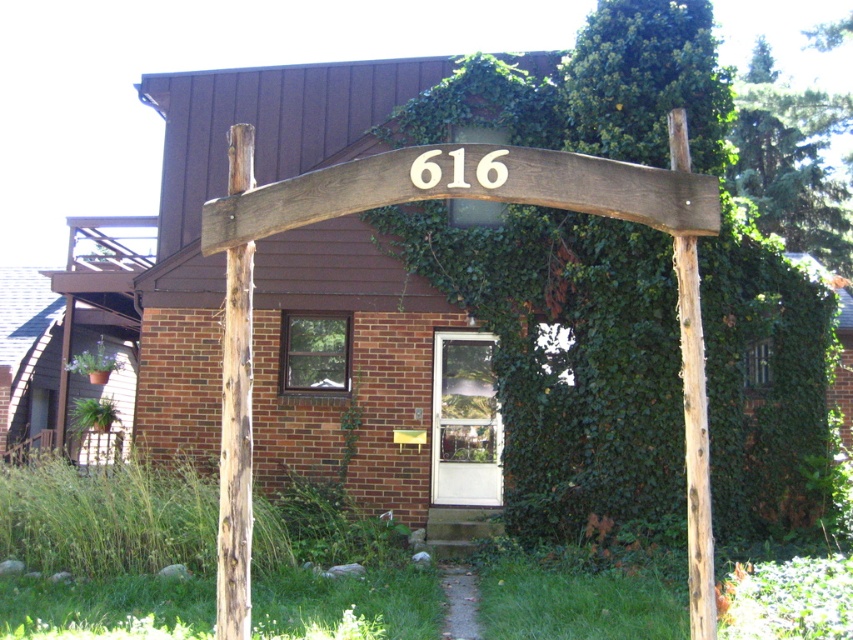
Is rough wooden post at center in front of brown rough wood post at right?

No, it is not.

This screenshot has height=640, width=853. In order to click on rough wooden post at center in this screenshot , I will do `click(235, 451)`.